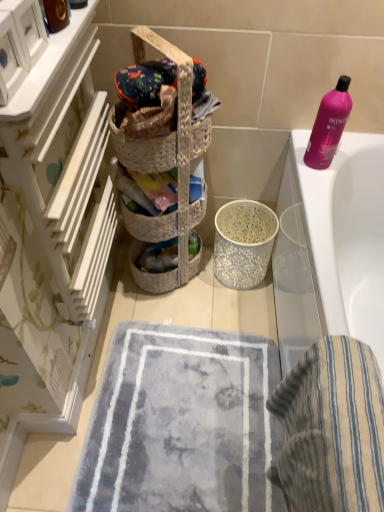
Find the location of a particular element. vacant space underneath white wood drawers at left (from a real-world perspective) is located at coordinates (119, 320).